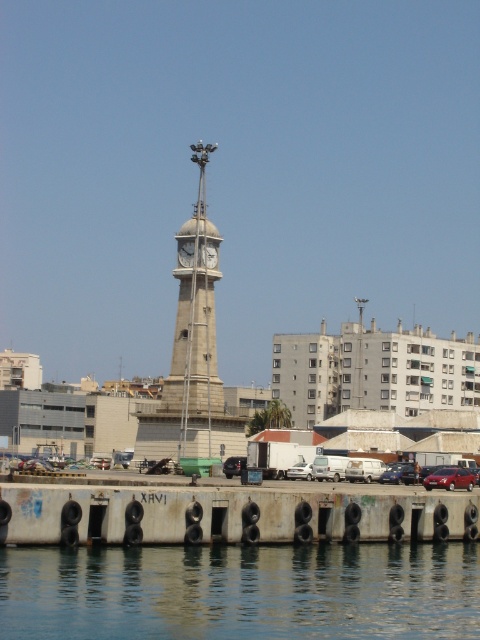
Question: Is concrete dock at lower center below shiny red sedan at lower right?

Choices:
 (A) yes
 (B) no

Answer: (B)

Question: Which object appears farthest from the camera in this image?

Choices:
 (A) concrete dock at lower center
 (B) shiny red sedan at lower right
 (C) white glossy clock at center

Answer: (C)

Question: Which point is closer to the camera?

Choices:
 (A) white stone clock at center
 (B) stone clock tower at center

Answer: (B)

Question: Considering the relative positions of shiny red sedan at lower right and white matte van at center in the image provided, where is shiny red sedan at lower right located with respect to white matte van at center?

Choices:
 (A) left
 (B) right

Answer: (B)

Question: Which point appears farthest from the camera in this image?

Choices:
 (A) (158, 410)
 (B) (431, 484)
 (C) (181, 257)

Answer: (A)

Question: Can you confirm if shiny red sedan at lower right is positioned above white matte van at center?

Choices:
 (A) yes
 (B) no

Answer: (A)